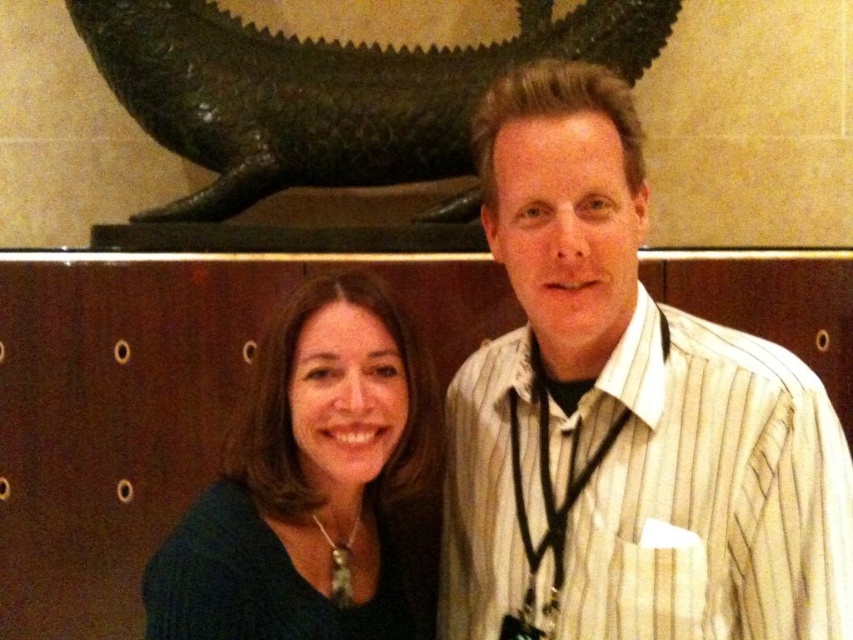
Question: Which of the following is the closest to the observer?

Choices:
 (A) dark green sweater at center
 (B) green patina stone sculpture at upper center
 (C) white striped shirt at center

Answer: (C)

Question: Does white striped shirt at center appear over dark green sweater at center?

Choices:
 (A) yes
 (B) no

Answer: (A)

Question: Which point is farther from the camera taking this photo?

Choices:
 (A) (292, 384)
 (B) (619, 3)
 (C) (550, 248)

Answer: (B)

Question: Among these objects, which one is farthest from the camera?

Choices:
 (A) white striped shirt at center
 (B) dark green sweater at center
 (C) green patina stone sculpture at upper center

Answer: (C)

Question: Is white striped shirt at center closer to the viewer compared to green patina stone sculpture at upper center?

Choices:
 (A) yes
 (B) no

Answer: (A)

Question: Does white striped shirt at center appear under green patina stone sculpture at upper center?

Choices:
 (A) no
 (B) yes

Answer: (B)